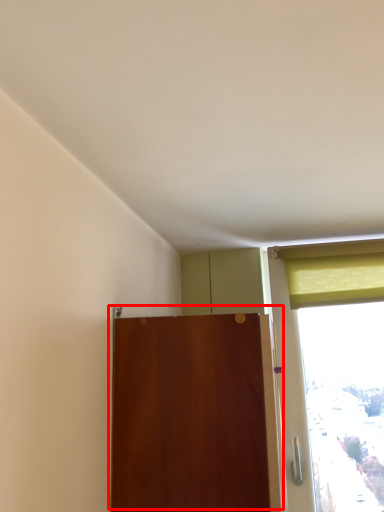
Question: Observing the image, what is the correct spatial positioning of door (annotated by the red box) in reference to curtain?

Choices:
 (A) left
 (B) right

Answer: (A)